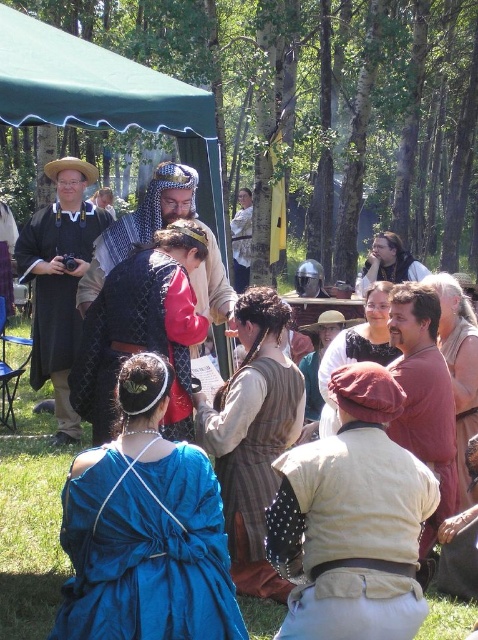
You are navigating through a medieval festival and want to reach a specific location. You see two points marked in the scene. Which point is closer to you, point [43,236] or point [359,275]?

Point [43,236] is in front of point [359,275], so it is closer to you.